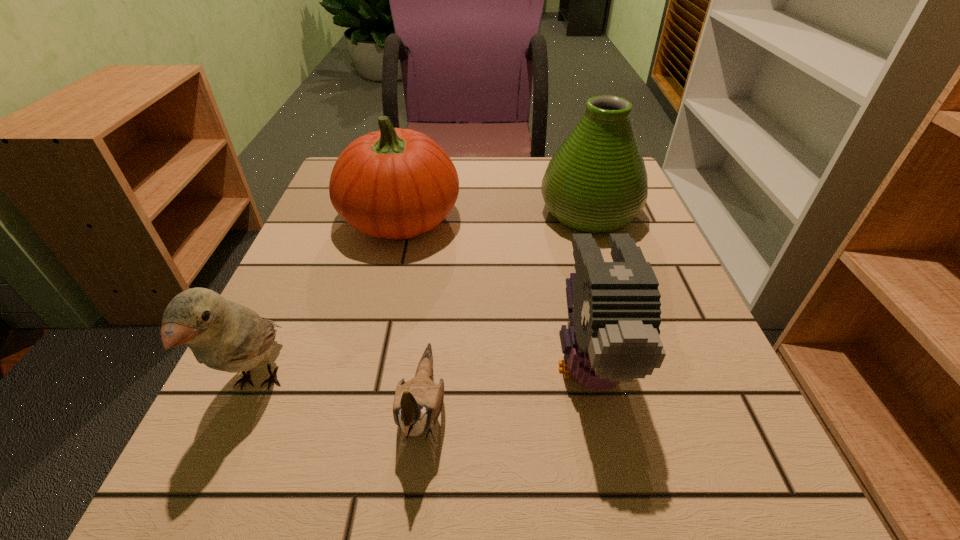
The width and height of the screenshot is (960, 540). I want to click on vacant space located 0.050m at the face of the shortest object, so click(411, 526).

Identify the location of vase that is at the far edge. (596, 182).

Identify the location of pumpkin that is at the far edge. (394, 183).

Identify the location of object located in the near edge section of the desktop. The height and width of the screenshot is (540, 960). (417, 404).

Find the location of a particular element. pumpkin situated at the left edge is located at coordinates (394, 183).

The image size is (960, 540). Find the location of `bird that is positioned at the left edge`. bird that is positioned at the left edge is located at coordinates (226, 336).

The height and width of the screenshot is (540, 960). In order to click on vase that is at the right edge in this screenshot , I will do `click(596, 182)`.

In order to click on bird at the right edge in this screenshot , I will do `click(614, 309)`.

What are the coordinates of `object that is at the far left corner` in the screenshot? It's located at (394, 183).

Find the location of a particular element. This screenshot has width=960, height=540. object that is positioned at the far right corner is located at coordinates (596, 182).